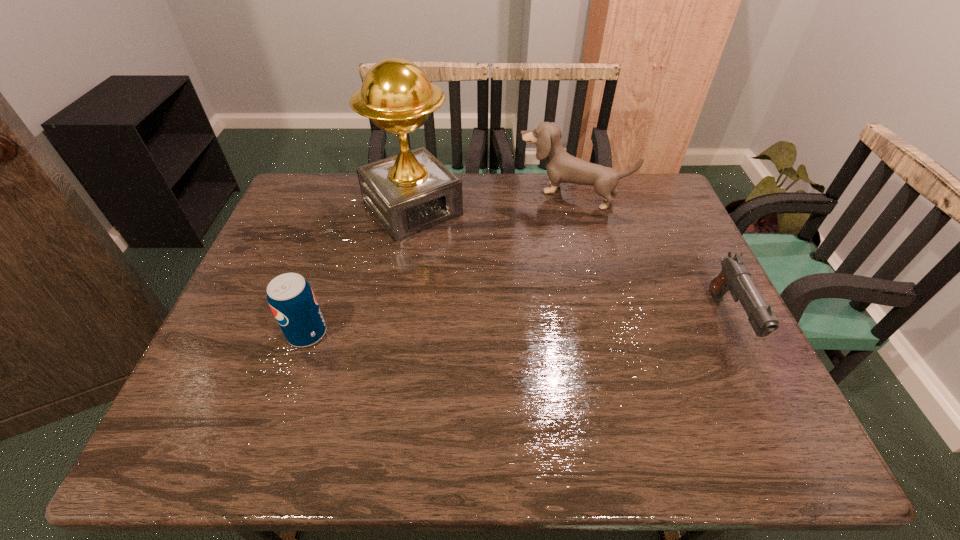
Identify the location of pop. The image size is (960, 540). (291, 298).

Locate an element on the screen. The height and width of the screenshot is (540, 960). gun is located at coordinates (734, 276).

This screenshot has width=960, height=540. I want to click on the third object from left to right, so click(561, 167).

Locate an element on the screen. The image size is (960, 540). puppy is located at coordinates (561, 167).

Identify the location of award. (413, 191).

The width and height of the screenshot is (960, 540). Identify the location of vacant space situated on the back of the pop. (343, 229).

Identify the location of vacant space located 0.100m in the direction the rightmost object is aimed. (768, 401).

You are a GUI agent. You are given a task and a screenshot of the screen. Output one action in this format:
    pyautogui.click(x=<x>, y=<y>)
    Task: Click on the free space located at the face of the second tallest object
    The width and height of the screenshot is (960, 540).
    Given the screenshot: What is the action you would take?
    pyautogui.click(x=515, y=255)

Find the location of a particular element. This screenshot has height=540, width=960. free space located at the face of the second tallest object is located at coordinates click(x=492, y=288).

The width and height of the screenshot is (960, 540). In order to click on free space located at the face of the second tallest object in this screenshot , I will do `click(514, 258)`.